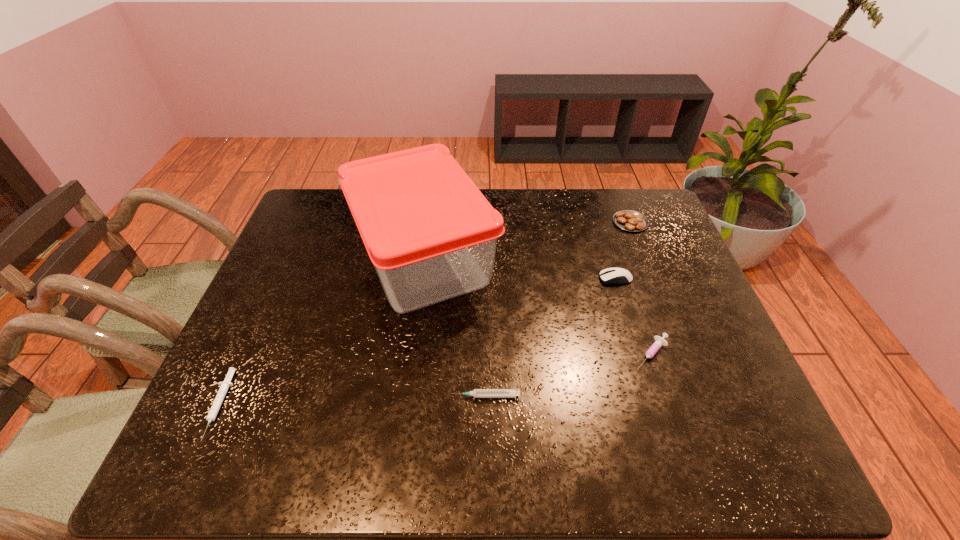
The width and height of the screenshot is (960, 540). In order to click on vacant space that's between the tallest object and the second syringe from left to right in this screenshot , I will do `click(454, 327)`.

The height and width of the screenshot is (540, 960). I want to click on unoccupied area between the second syringe from right to left and the mouse, so click(550, 338).

Identify the location of unoccupied area between the rightmost syringe and the pastry. (640, 288).

Locate an element on the screen. The height and width of the screenshot is (540, 960). free point between the mouse and the rightmost syringe is located at coordinates (634, 316).

Where is `free space between the mouse and the shortest object`? This screenshot has height=540, width=960. free space between the mouse and the shortest object is located at coordinates (418, 342).

Where is `free space between the mouse and the tray`? free space between the mouse and the tray is located at coordinates (519, 268).

Locate an element on the screen. The image size is (960, 540). vacant point located between the second syringe from right to left and the pastry is located at coordinates (558, 309).

Where is `vacant space that is in between the pastry and the mouse`? The width and height of the screenshot is (960, 540). vacant space that is in between the pastry and the mouse is located at coordinates (623, 251).

Identify the location of object that is the third nearest to the rightmost syringe. (431, 235).

This screenshot has width=960, height=540. I want to click on the third closest object relative to the rightmost syringe, so click(x=431, y=235).